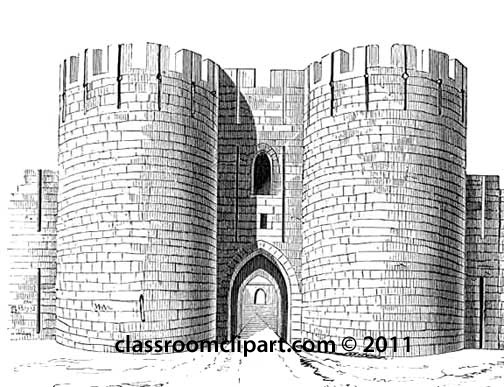
The width and height of the screenshot is (504, 387). In order to click on doorway in this screenshot , I will do `click(256, 318)`.